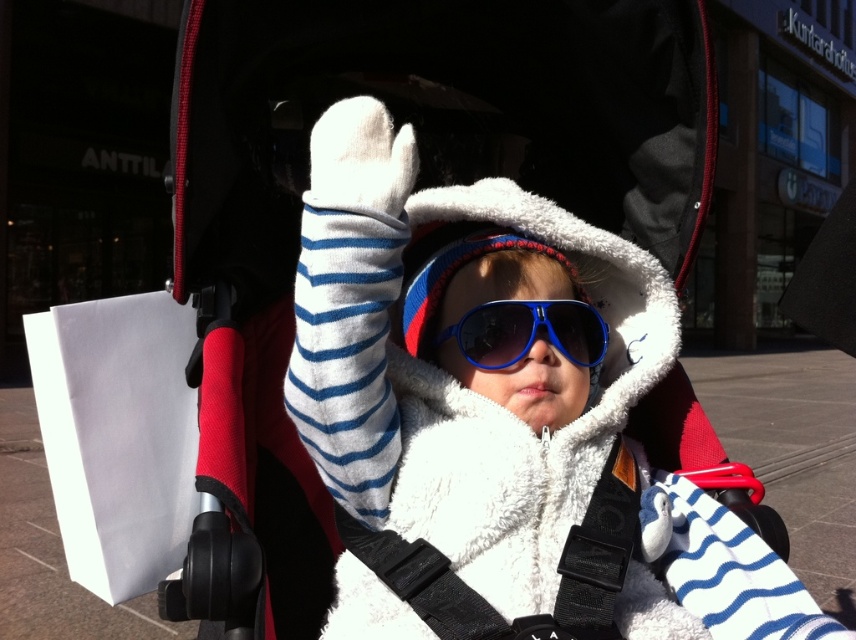
Between black fabric strap at center and blue plastic goggles at center, which one is positioned higher?

Positioned higher is blue plastic goggles at center.

Does black fabric strap at center lie in front of blue plastic goggles at center?

Yes, it is in front of blue plastic goggles at center.

Who is more forward, [395,572] or [562,305]?

Point [395,572] is more forward.

You are a GUI agent. You are given a task and a screenshot of the screen. Output one action in this format:
    pyautogui.click(x=<x>, y=<y>)
    Task: Click on the black fabric strap at center
    
    Given the screenshot: What is the action you would take?
    556,568